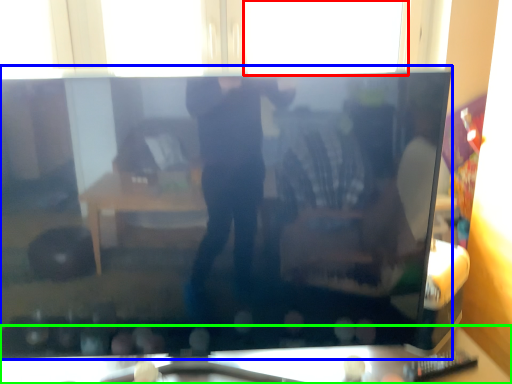
Question: Considering the real-world distances, which object is closest to window (highlighted by a red box)? television (highlighted by a blue box) or furniture (highlighted by a green box).

Choices:
 (A) television
 (B) furniture

Answer: (A)